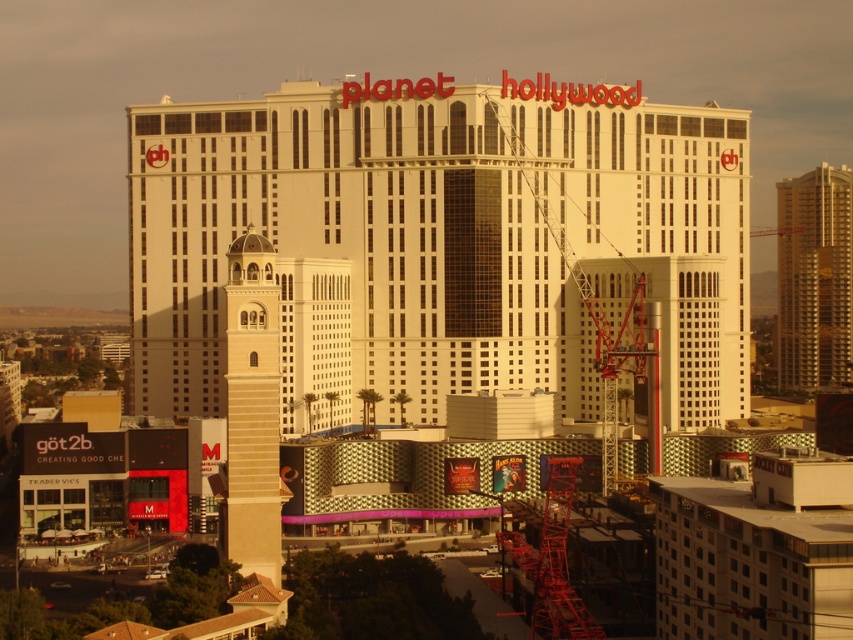
Based on the photo, can you confirm if white textured building at center is positioned to the right of gold metallic building at right?

No, white textured building at center is not to the right of gold metallic building at right.

Between point (317, 176) and point (785, 200), which one is positioned in front?

Point (317, 176) is in front.

Image resolution: width=853 pixels, height=640 pixels. Find the location of `white textured building at center`. white textured building at center is located at coordinates (440, 234).